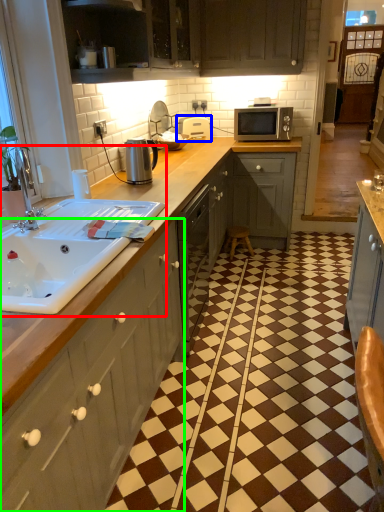
Question: Which object is positioned farthest from sink (highlighted by a red box)? Select from appliance (highlighted by a blue box) and cabinetry (highlighted by a green box).

Choices:
 (A) appliance
 (B) cabinetry

Answer: (A)